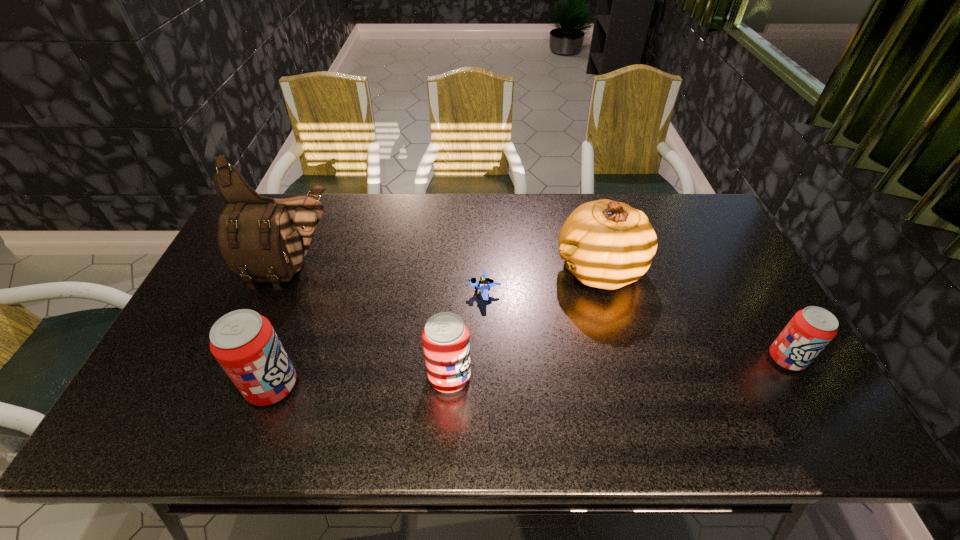
Image resolution: width=960 pixels, height=540 pixels. What are the coordinates of `the leftmost soda can` in the screenshot? It's located at (244, 343).

This screenshot has height=540, width=960. In order to click on the second shortest soda can in this screenshot , I will do `click(445, 338)`.

You are a GUI agent. You are given a task and a screenshot of the screen. Output one action in this format:
    pyautogui.click(x=<x>, y=<y>)
    Task: Click on the second soda can from left to right
    
    Given the screenshot: What is the action you would take?
    pyautogui.click(x=445, y=338)

The height and width of the screenshot is (540, 960). In order to click on the rightmost object in this screenshot , I will do `click(810, 330)`.

This screenshot has height=540, width=960. What are the coordinates of `the fifth tallest object` in the screenshot? It's located at (810, 330).

Locate an element on the screen. the fifth object from left to right is located at coordinates (606, 244).

Image resolution: width=960 pixels, height=540 pixels. Identify the location of the tallest object. (262, 239).

Where is `the shortest object`? The image size is (960, 540). the shortest object is located at coordinates point(484,284).

I want to click on vacant space located 0.210m on the surface of the leftmost soda can, so click(x=385, y=386).

This screenshot has width=960, height=540. I want to click on free space located on the surface of the fourth tallest object, so click(x=508, y=376).